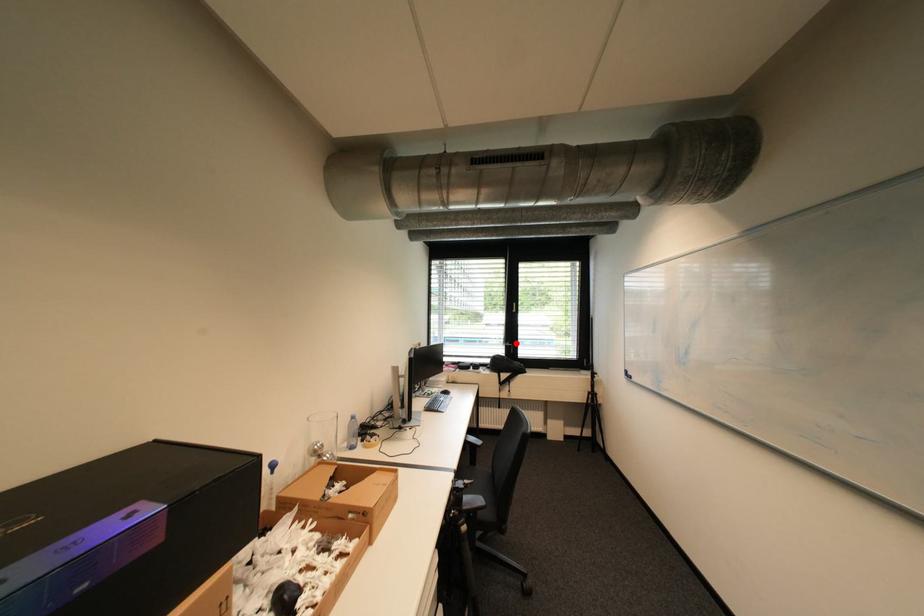
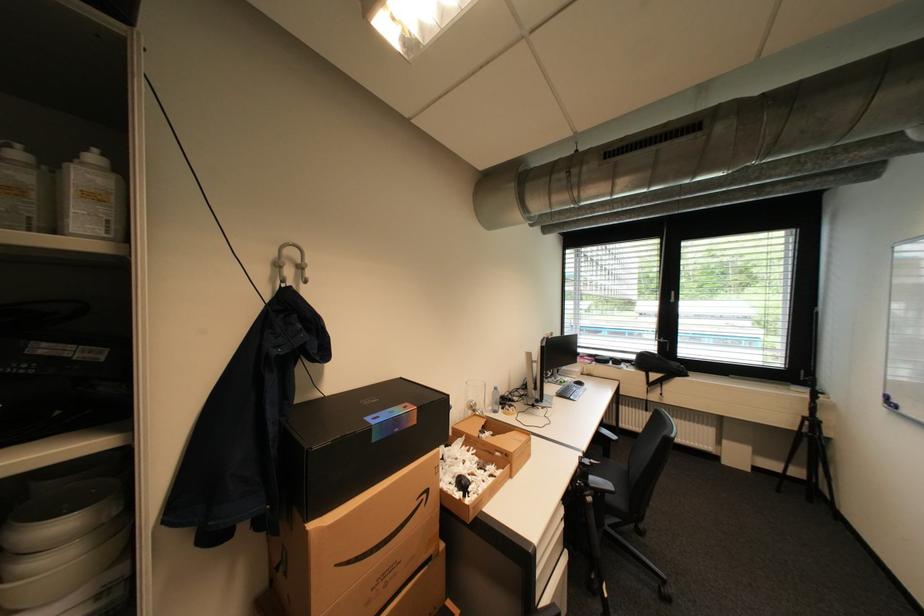
In the second image, find the point that corresponds to the highlighted location in the first image.

(670, 339)